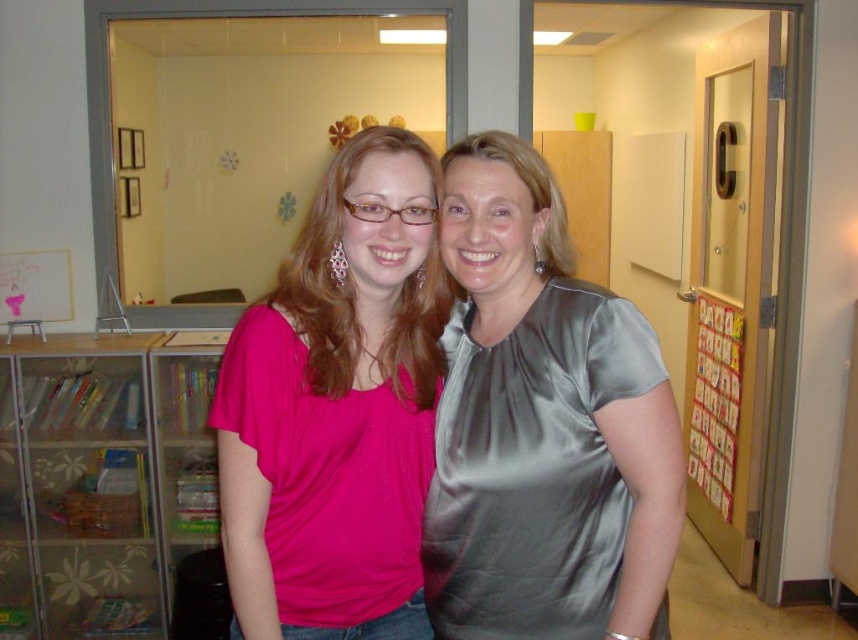
Question: Which of these objects is positioned farthest from the translucent plastic bookshelf at left?

Choices:
 (A) satin gray dress at center
 (B) pink satin blouse at center

Answer: (A)

Question: Can you confirm if pink satin blouse at center is wider than translucent plastic bookshelf at left?

Choices:
 (A) no
 (B) yes

Answer: (A)

Question: Which of these objects is positioned closest to the satin gray dress at center?

Choices:
 (A) pink satin blouse at center
 (B) translucent plastic bookshelf at left

Answer: (A)

Question: Does satin gray dress at center appear on the left side of translucent plastic bookshelf at left?

Choices:
 (A) no
 (B) yes

Answer: (A)

Question: Is satin gray dress at center closer to camera compared to translucent plastic bookshelf at left?

Choices:
 (A) yes
 (B) no

Answer: (A)

Question: Which is farther from the translucent plastic bookshelf at left?

Choices:
 (A) satin gray dress at center
 (B) pink satin blouse at center

Answer: (A)